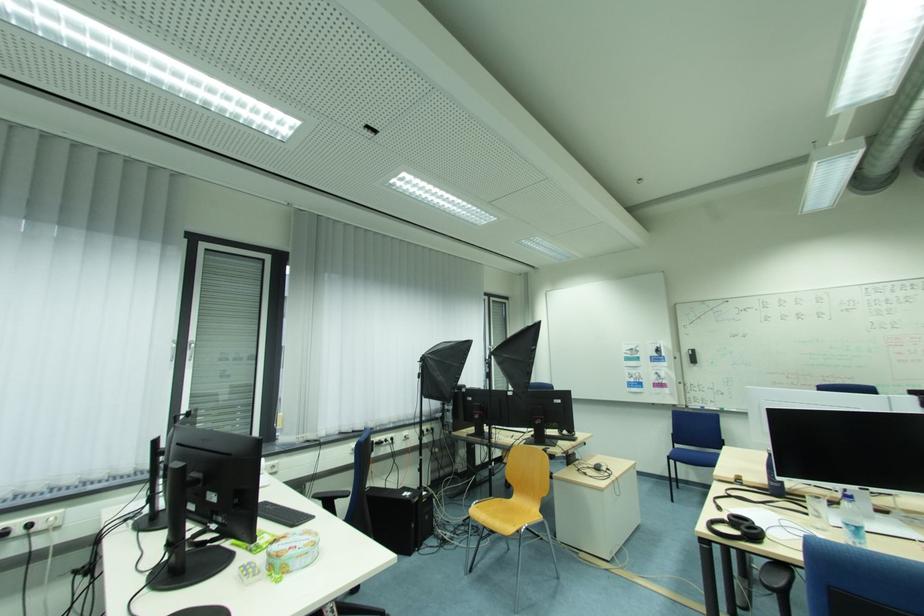
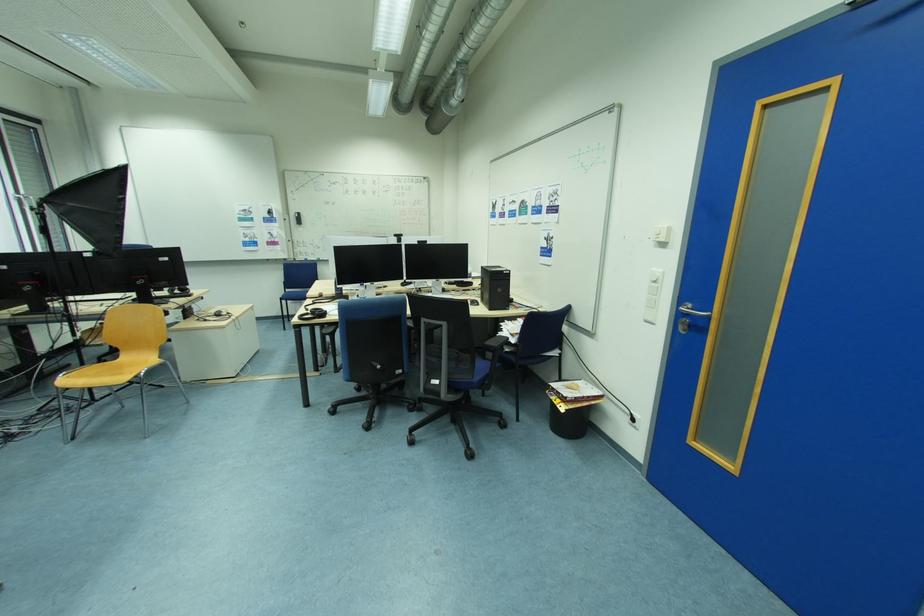
The point at (726, 509) is marked in the first image. Where is the corresponding point in the second image?

(313, 310)